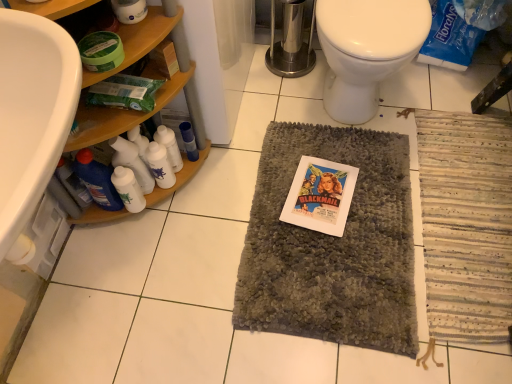
At what (x,y) coordinates should I click in order to perform the action: click on free space to the right of white glossy bottle at lower left, the 4th bottle viewed from the right. Please return your answer as a coordinate pair (x, y). Looking at the image, I should click on (189, 212).